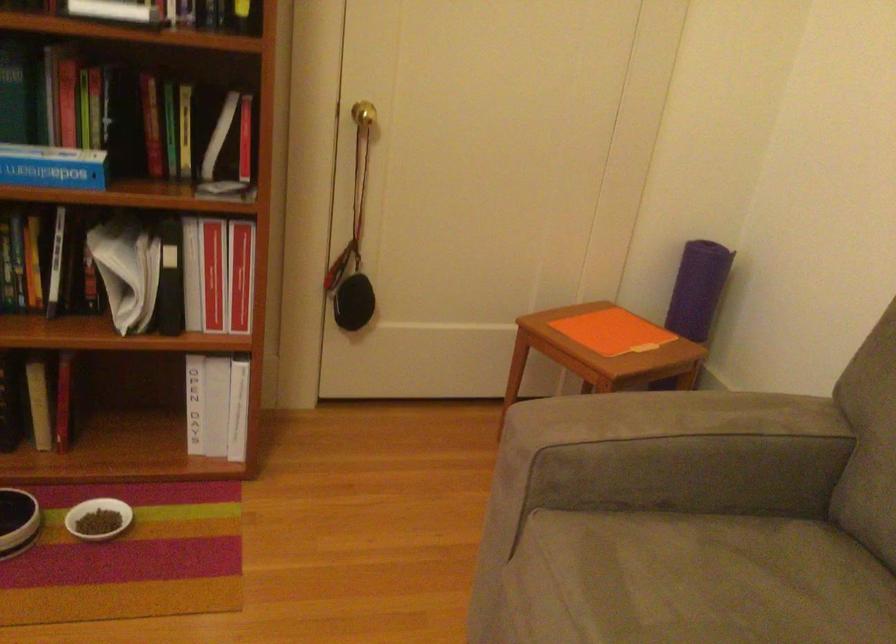
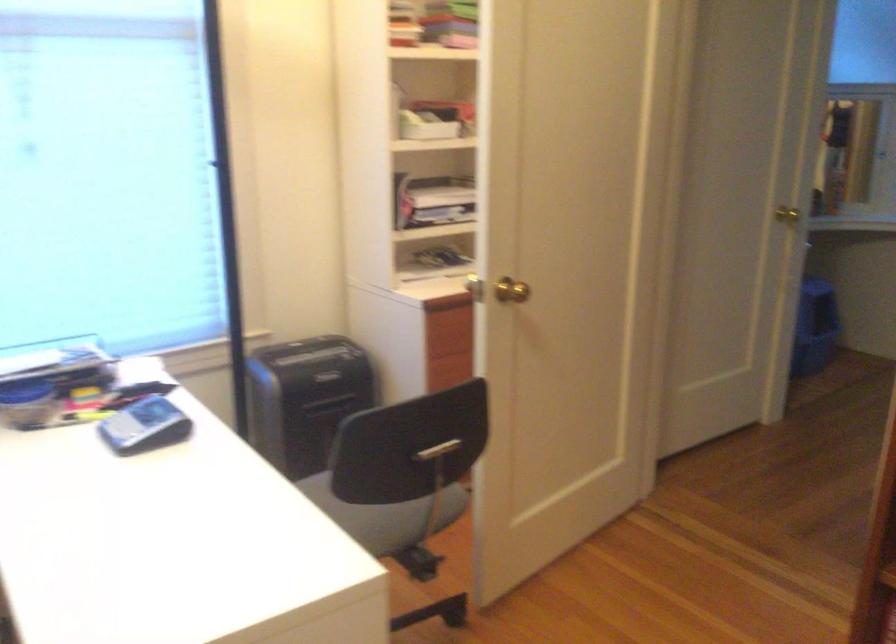
Question: The first image is from the beginning of the video and the second image is from the end. How did the camera likely rotate when shooting the video?

Choices:
 (A) Left
 (B) Right
 (C) Up
 (D) Down

Answer: (A)